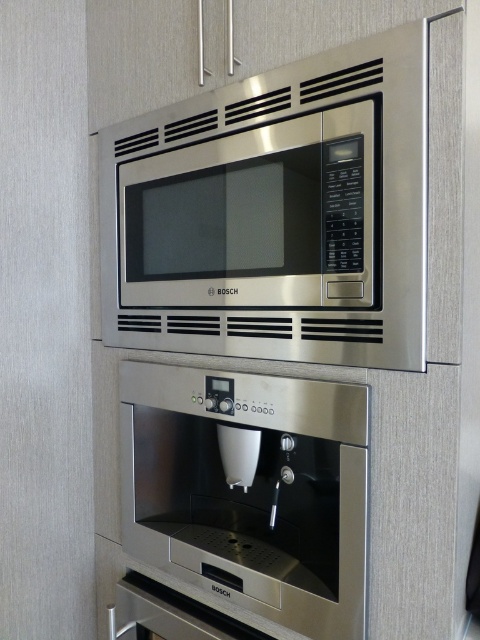
You are a kitchen designer planning to install a new appliance between the stainless steel microwave at upper center and the stainless steel coffee machine at center. Based on their current positions, which side of the coffee machine should the new appliance be placed to maintain symmetry?

The stainless steel microwave at upper center is positioned on the left side of the stainless steel coffee machine at center, so to maintain symmetry, the new appliance should be placed on the right side of the coffee machine.

You are standing in front of the kitchen appliances and want to reach a specific point marked at coordinates point (346, 348). Your arm can extend up to 35 inches. Can you comfortably reach that point?

The distance of point (346, 348) from viewer is 35.24 inches, so your arm can only extend 35 inches. Therefore, you cannot comfortably reach that point as it is slightly further than your arm can extend.

You are standing in the kitchen and want to reach both the stainless steel microwave at upper center and the stainless steel coffee machine at center. Which appliance will require you to bend down more to access?

The stainless steel coffee machine at center requires bending down more because it is positioned lower and farther from the viewer compared to the microwave.